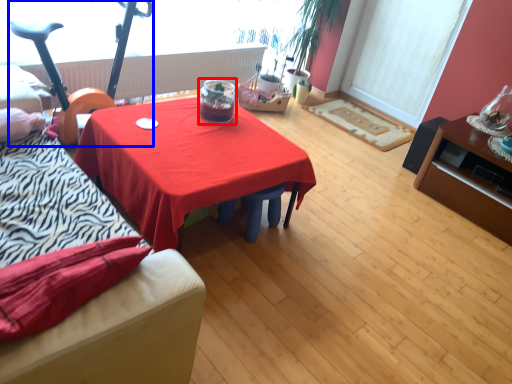
Question: Which point is further to the camera, glass jar (highlighted by a red box) or baby carriage (highlighted by a blue box)?

Choices:
 (A) glass jar
 (B) baby carriage

Answer: (A)